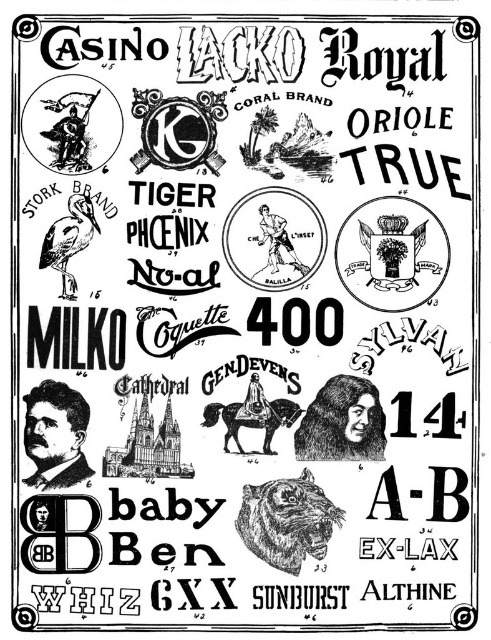
Question: Considering the real-world distances, which object is farthest from the brown leather horse at center?

Choices:
 (A) black ink drawing of a person at center
 (B) brown textured tiger head at center

Answer: (B)

Question: Is brown textured tiger head at center to the right of black matte stork at left from the viewer's perspective?

Choices:
 (A) yes
 (B) no

Answer: (A)

Question: Estimate the real-world distances between objects in this image. Which object is closer to the brown leather horse at center?

Choices:
 (A) black matte stork at left
 (B) black ink drawing of a person at center

Answer: (B)

Question: Which of these objects is positioned closest to the brown leather horse at center?

Choices:
 (A) black matte stork at left
 (B) brown textured tiger head at center
 (C) black ink drawing of a person at center

Answer: (C)

Question: Does black matte stork at left appear on the right side of brown leather horse at center?

Choices:
 (A) no
 (B) yes

Answer: (A)

Question: Is the position of black matte stork at left less distant than that of brown leather horse at center?

Choices:
 (A) no
 (B) yes

Answer: (A)